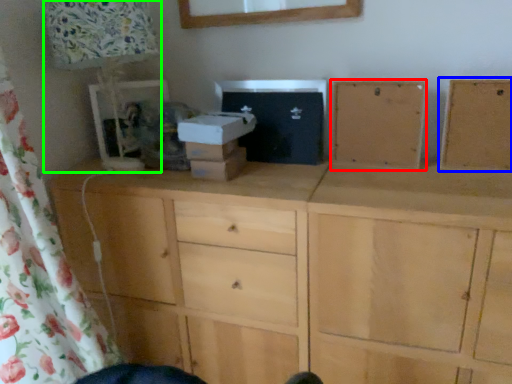
Question: Considering the real-world distances, which object is closest to cabinetry (highlighted by a red box)? cabinetry (highlighted by a blue box) or table lamp (highlighted by a green box).

Choices:
 (A) cabinetry
 (B) table lamp

Answer: (A)